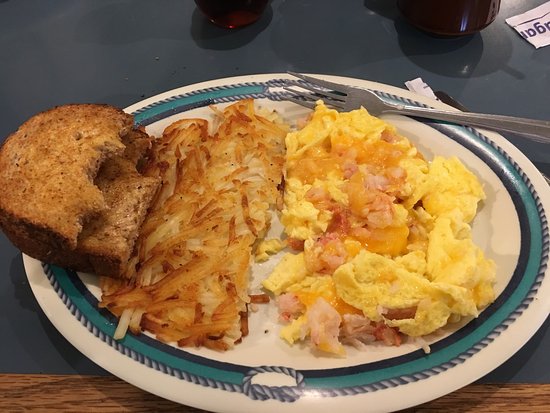
You are a GUI agent. You are given a task and a screenshot of the screen. Output one action in this format:
    pyautogui.click(x=<x>, y=<y>)
    Task: Click on the table
    This screenshot has height=413, width=550.
    Given the screenshot: What is the action you would take?
    pyautogui.click(x=528, y=396)